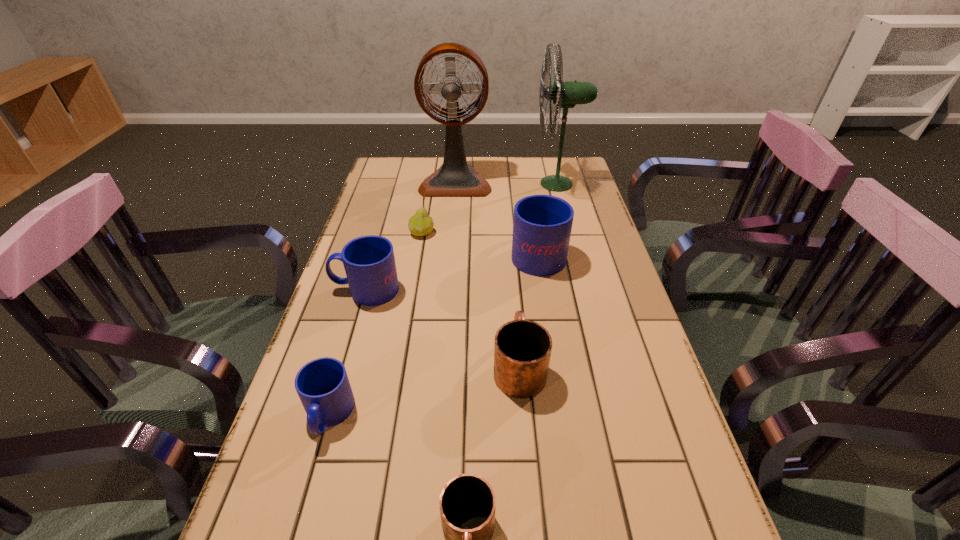
Find the location of a particular element. free point located on the front-facing side of the right fan is located at coordinates (427, 184).

Find the location of a particular element. The height and width of the screenshot is (540, 960). free space located 0.100m on the front-facing side of the right fan is located at coordinates (506, 184).

In order to click on free space located on the front-facing side of the right fan in this screenshot , I will do `click(427, 184)`.

At what (x,y) coordinates should I click in order to perform the action: click on free space located on the side with the handle of the tallest mug. Please return your answer as a coordinate pair (x, y). Looking at the image, I should click on [x=529, y=196].

The height and width of the screenshot is (540, 960). Identify the location of vacant space located on the side with the handle of the tallest mug. (529, 196).

Find the location of a particular element. Image resolution: width=960 pixels, height=540 pixels. free space located 0.360m on the side with the handle of the tallest mug is located at coordinates (525, 176).

Where is `blank space located 0.230m on the front of the green pear`? This screenshot has height=540, width=960. blank space located 0.230m on the front of the green pear is located at coordinates (412, 291).

This screenshot has height=540, width=960. I want to click on free spot located on the side of the bigger rust mug with the handle, so click(x=516, y=317).

I want to click on vacant space situated on the side of the bigger rust mug with the handle, so click(511, 266).

Locate an element on the screen. This screenshot has width=960, height=540. vacant area situated on the side of the bigger rust mug with the handle is located at coordinates (512, 273).